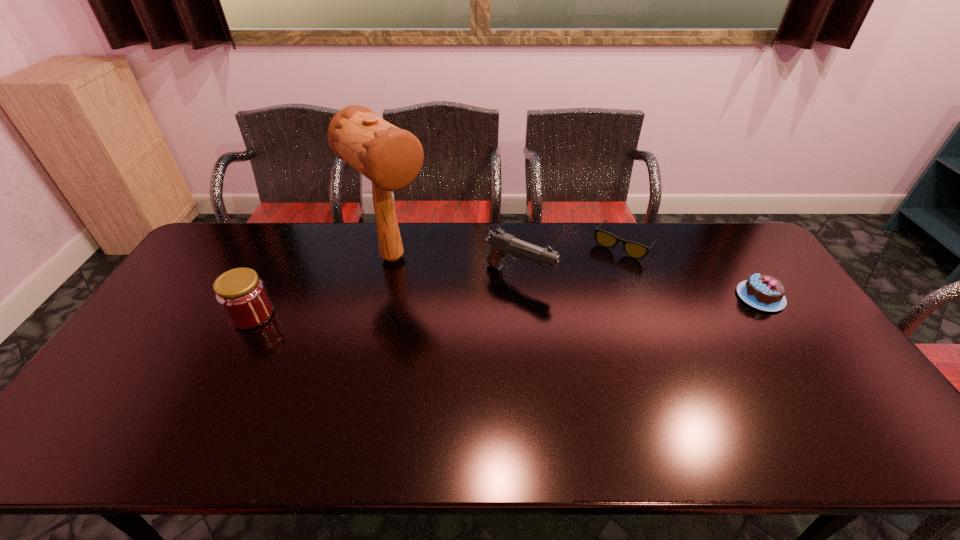
Locate an element on the screen. This screenshot has height=540, width=960. free spot that satisfies the following two spatial constraints: 1. on the back side of the fourth object from right to left; 2. on the left side of the sunglasses is located at coordinates (396, 245).

I want to click on vacant space that satisfies the following two spatial constraints: 1. on the back side of the jam; 2. on the left side of the shortest object, so click(x=289, y=245).

Locate an element on the screen. This screenshot has height=540, width=960. blank space that satisfies the following two spatial constraints: 1. on the front side of the chocolate cake; 2. on the right side of the sunglasses is located at coordinates (644, 297).